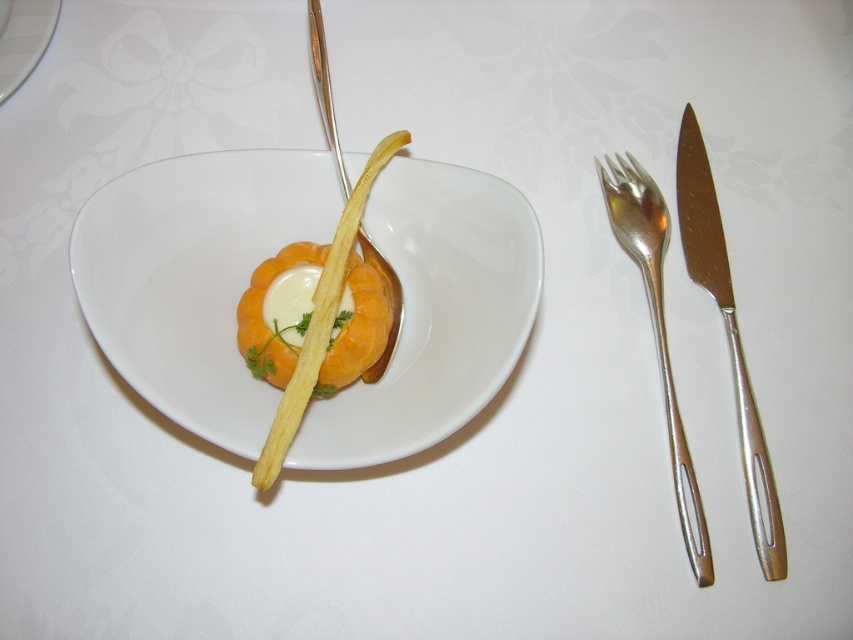
Based on the photo, which of these two, white glossy bowl at center or silver metallic fork at right, stands shorter?

With less height is white glossy bowl at center.

Is the position of white glossy bowl at center less distant than that of silver metallic fork at right?

Yes.

The height and width of the screenshot is (640, 853). I want to click on white glossy bowl at center, so click(194, 276).

Does polished silver knife at right have a larger size compared to white glossy plate at upper left?

Correct, polished silver knife at right is larger in size than white glossy plate at upper left.

Which is behind, point (759, 502) or point (57, 6)?

The point (57, 6) is more distant.

You are a GUI agent. You are given a task and a screenshot of the screen. Output one action in this format:
    pyautogui.click(x=<x>, y=<y>)
    Task: Click on the polished silver knife at right
    Image resolution: width=853 pixels, height=640 pixels.
    Given the screenshot: What is the action you would take?
    pyautogui.click(x=727, y=337)

Is point (659, 218) more distant than point (6, 8)?

Yes, point (659, 218) is behind point (6, 8).

Who is more forward, (675, 400) or (13, 65)?

Positioned in front is point (675, 400).

Find the location of `silver metallic fork at right`. silver metallic fork at right is located at coordinates (656, 328).